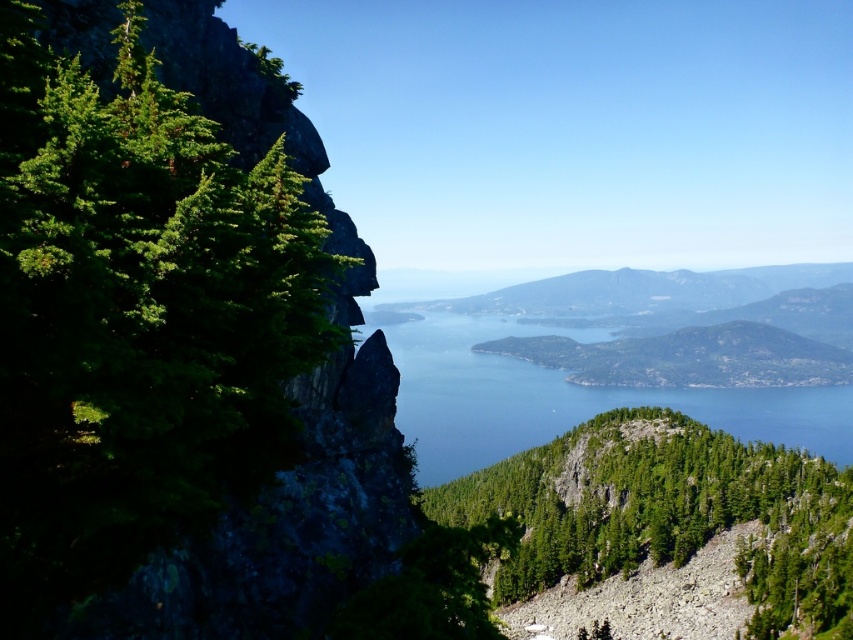
Question: Is green rough textured tree at center wider than blue water at center?

Choices:
 (A) yes
 (B) no

Answer: (B)

Question: Which point is farther to the camera?

Choices:
 (A) green rough textured tree at center
 (B) blue water at center

Answer: (B)

Question: Does green rough textured tree at center come in front of blue water at center?

Choices:
 (A) no
 (B) yes

Answer: (B)

Question: Does green rough textured tree at center appear over blue water at center?

Choices:
 (A) no
 (B) yes

Answer: (B)